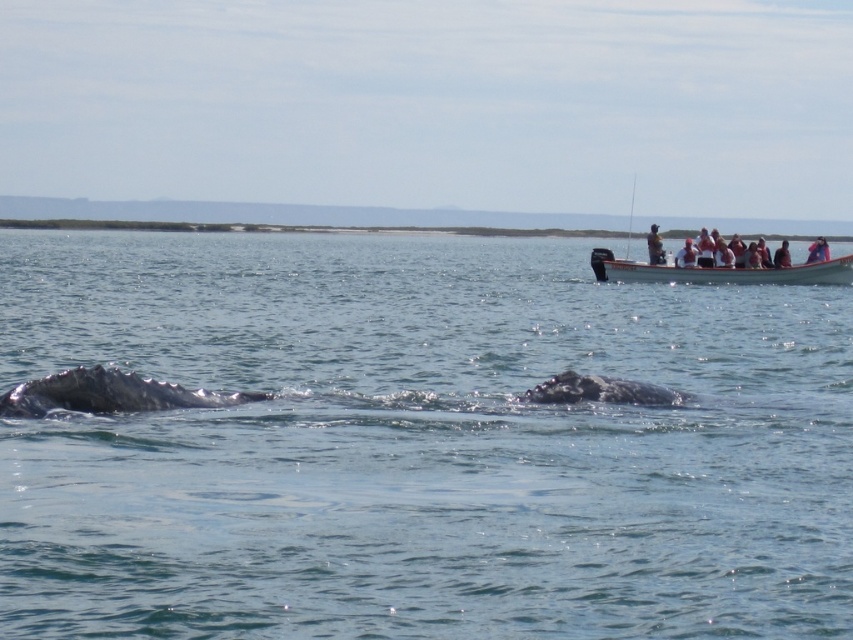
Can you confirm if white wooden boat at upper right is taller than white plastic boat at upper right?

Yes, white wooden boat at upper right is taller than white plastic boat at upper right.

Find the location of a particular element. The height and width of the screenshot is (640, 853). white wooden boat at upper right is located at coordinates (715, 269).

Which is below, gray matte whale at center or light brown wooden paddle at upper right?

gray matte whale at center is below.

The width and height of the screenshot is (853, 640). I want to click on gray matte whale at center, so click(x=602, y=392).

At what (x,y) coordinates should I click in order to perform the action: click on gray matte whale at center. Please return your answer as a coordinate pair (x, y). The width and height of the screenshot is (853, 640). Looking at the image, I should click on (602, 392).

Is clear blue water at center to the left of gray matte whale at center from the viewer's perspective?

Correct, you'll find clear blue water at center to the left of gray matte whale at center.

Is clear blue water at center above gray matte whale at center?

Yes.

The image size is (853, 640). Find the location of `clear blue water at center`. clear blue water at center is located at coordinates (418, 444).

This screenshot has height=640, width=853. Identify the location of clear blue water at center. (418, 444).